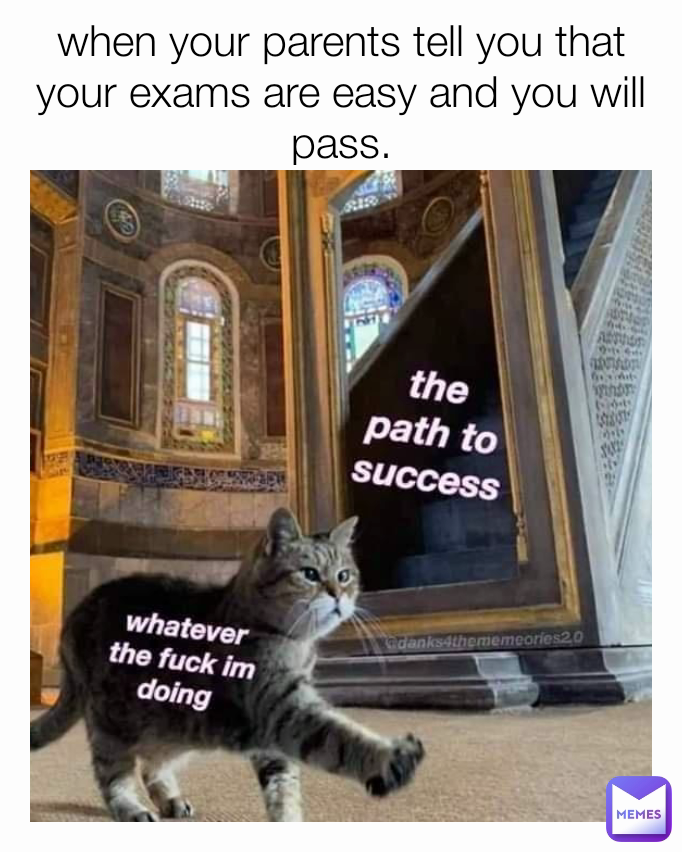
Identify the location of tan carpet. Image resolution: width=682 pixels, height=852 pixels. (606, 729), (582, 792), (460, 728), (464, 792), (196, 798), (28, 780), (89, 793).